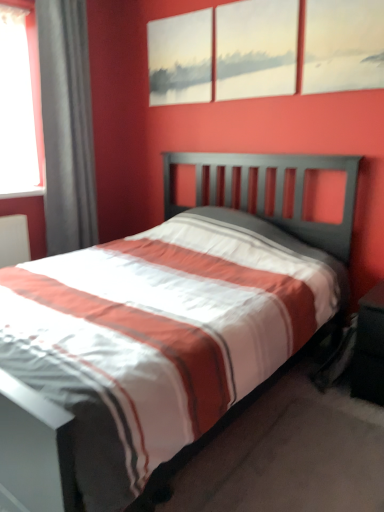
Question: Considering the relative sizes of matte gray painting at upper center, positioned as the 1th picture frame in left-to-right order, and matte canvas painting at upper center, arranged as the 3th picture frame when viewed from the left, in the image provided, is matte gray painting at upper center, positioned as the 1th picture frame in left-to-right order, shorter than matte canvas painting at upper center, arranged as the 3th picture frame when viewed from the left,?

Choices:
 (A) no
 (B) yes

Answer: (A)

Question: Is matte gray painting at upper center, positioned as the 1th picture frame in left-to-right order, positioned before matte canvas painting at upper center, arranged as the 3th picture frame when viewed from the left?

Choices:
 (A) yes
 (B) no

Answer: (B)

Question: Considering the relative sizes of matte gray painting at upper center, positioned as the 1th picture frame in left-to-right order, and matte canvas painting at upper center, the first picture frame in the right-to-left sequence, in the image provided, is matte gray painting at upper center, positioned as the 1th picture frame in left-to-right order, wider than matte canvas painting at upper center, the first picture frame in the right-to-left sequence,?

Choices:
 (A) yes
 (B) no

Answer: (A)

Question: Does matte gray painting at upper center, positioned as the 1th picture frame in left-to-right order, have a greater height compared to matte canvas painting at upper center, arranged as the 3th picture frame when viewed from the left?

Choices:
 (A) yes
 (B) no

Answer: (A)

Question: From a real-world perspective, is matte gray painting at upper center, marked as the 3th picture frame in a right-to-left arrangement, physically below matte canvas painting at upper center, arranged as the 3th picture frame when viewed from the left?

Choices:
 (A) no
 (B) yes

Answer: (A)

Question: From the image's perspective, is matte white canvas at upper center, the 2th picture frame positioned from the left, positioned above or below gray fabric curtain at left?

Choices:
 (A) below
 (B) above

Answer: (B)

Question: Looking at the image, does matte white canvas at upper center, the 2th picture frame positioned from the left, seem bigger or smaller compared to gray fabric curtain at left?

Choices:
 (A) big
 (B) small

Answer: (B)

Question: Is point (278, 73) positioned closer to the camera than point (82, 170)?

Choices:
 (A) closer
 (B) farther

Answer: (A)

Question: From a real-world perspective, is matte white canvas at upper center, the 2th picture frame positioned from the left, above or below gray fabric curtain at left?

Choices:
 (A) below
 (B) above

Answer: (B)

Question: Is point (332, 29) positioned closer to the camera than point (180, 41)?

Choices:
 (A) closer
 (B) farther

Answer: (A)

Question: In the image, is matte canvas painting at upper center, the first picture frame in the right-to-left sequence, on the left side or the right side of matte gray painting at upper center, marked as the 3th picture frame in a right-to-left arrangement?

Choices:
 (A) right
 (B) left

Answer: (A)

Question: Looking at their shapes, would you say matte canvas painting at upper center, the first picture frame in the right-to-left sequence, is wider or thinner than matte gray painting at upper center, positioned as the 1th picture frame in left-to-right order?

Choices:
 (A) thin
 (B) wide

Answer: (A)

Question: From their relative heights in the image, would you say matte canvas painting at upper center, the first picture frame in the right-to-left sequence, is taller or shorter than matte gray painting at upper center, positioned as the 1th picture frame in left-to-right order?

Choices:
 (A) short
 (B) tall

Answer: (A)

Question: In terms of height, does matte white canvas at upper center, the second picture frame positioned from the right, look taller or shorter compared to matte canvas painting at upper center, the first picture frame in the right-to-left sequence?

Choices:
 (A) short
 (B) tall

Answer: (B)

Question: From a real-world perspective, relative to matte canvas painting at upper center, the first picture frame in the right-to-left sequence, is matte white canvas at upper center, the second picture frame positioned from the right, vertically above or below?

Choices:
 (A) above
 (B) below

Answer: (A)